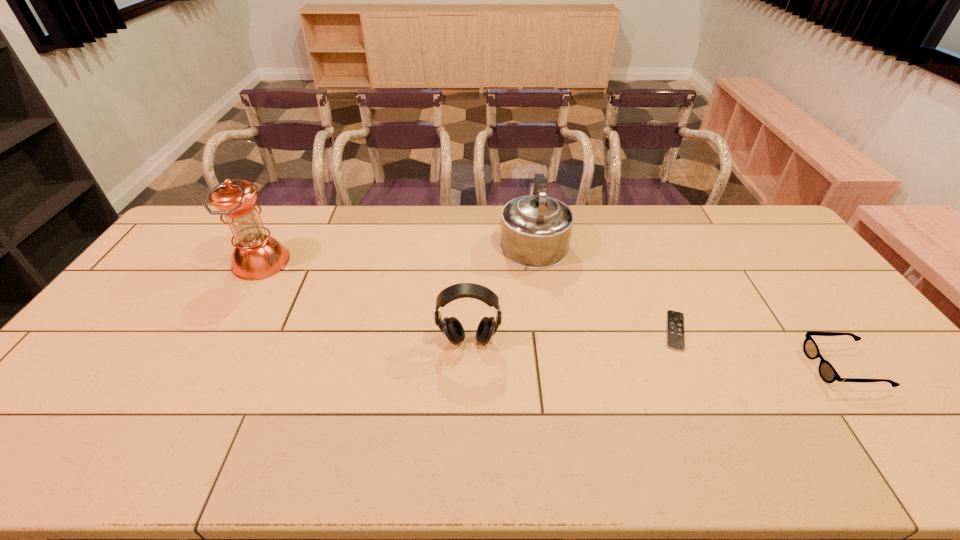
Image resolution: width=960 pixels, height=540 pixels. Identify the location of vacant space at the near edge. (x=135, y=447).

This screenshot has width=960, height=540. Find the location of `vacant space at the left edge of the desktop`. vacant space at the left edge of the desktop is located at coordinates (192, 278).

Find the location of `vacant point at the right edge`. vacant point at the right edge is located at coordinates tap(851, 369).

Identify the location of vacant region at the far right corner of the desktop. Image resolution: width=960 pixels, height=540 pixels. (744, 220).

You are a GUI agent. You are given a task and a screenshot of the screen. Output one action in this format:
    pyautogui.click(x=<x>, y=<y>)
    Task: Click on the vacant space that is in between the second shortest object and the shortest object
    
    Given the screenshot: What is the action you would take?
    pyautogui.click(x=759, y=349)

The height and width of the screenshot is (540, 960). In order to click on free area in between the earphone and the fourth tallest object in this screenshot , I will do `click(656, 354)`.

Find the location of a particular element. Image resolution: width=960 pixels, height=540 pixels. empty space that is in between the rightmost object and the oil lamp is located at coordinates (552, 315).

I want to click on blank region between the fourth object from left to right and the kettle, so click(x=604, y=285).

The image size is (960, 540). I want to click on vacant area between the tallest object and the second tallest object, so click(397, 251).

Find the location of `free space between the kettle and the shortest object`. free space between the kettle and the shortest object is located at coordinates (604, 285).